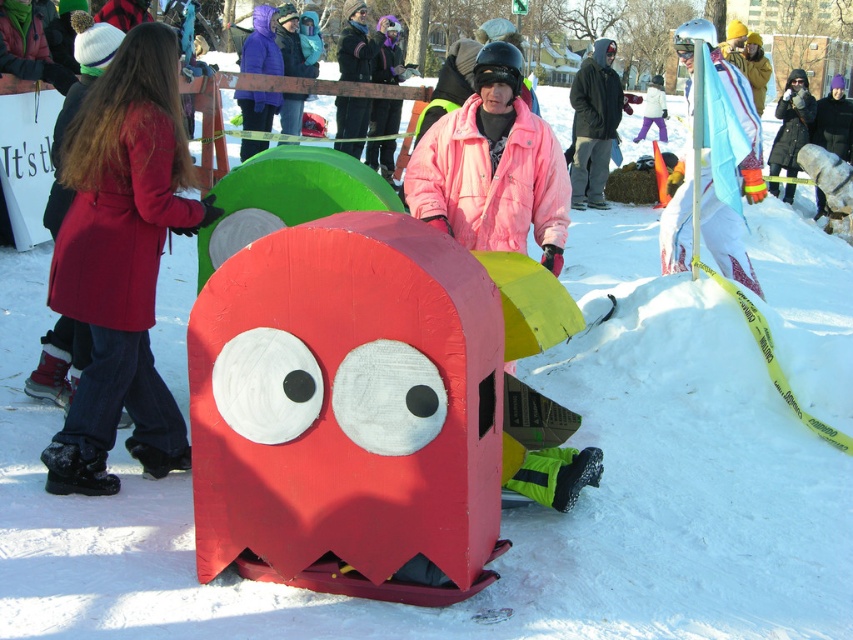
Which is below, dark gray hooded jacket at center or purple matte jacket at upper center?

dark gray hooded jacket at center is below.

Is dark gray hooded jacket at center below purple matte jacket at upper center?

Yes.

You are a GUI agent. You are given a task and a screenshot of the screen. Output one action in this format:
    pyautogui.click(x=<x>, y=<y>)
    Task: Click on the dark gray hooded jacket at center
    The height and width of the screenshot is (640, 853).
    Given the screenshot: What is the action you would take?
    pyautogui.click(x=593, y=124)

Image resolution: width=853 pixels, height=640 pixels. Find the location of `dark gray hooded jacket at center`. dark gray hooded jacket at center is located at coordinates point(593,124).

Which is above, matte red coat at left or purple matte jacket at upper center?

purple matte jacket at upper center

Locate an element on the screen. This screenshot has width=853, height=640. matte red coat at left is located at coordinates (120, 260).

Is purple matte jacket at upper center taller than black fur coat at upper right?

Incorrect, purple matte jacket at upper center's height is not larger of black fur coat at upper right's.

Between point (256, 99) and point (769, 161), which one is positioned in front?

Point (256, 99) is in front.

What are the coordinates of `purple matte jacket at upper center` in the screenshot? It's located at (260, 44).